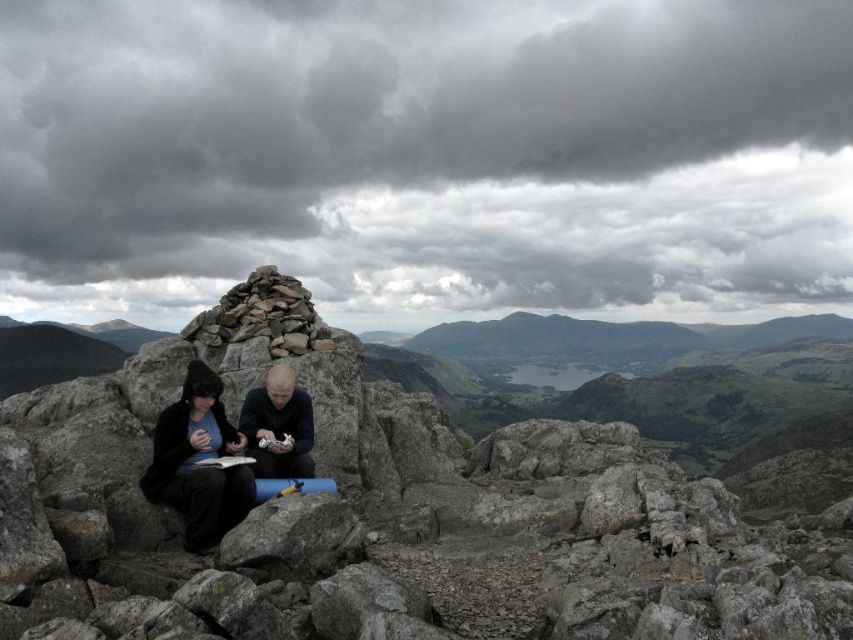
Question: Can you confirm if matte black jacket at center is thinner than black matte jacket at center?

Choices:
 (A) no
 (B) yes

Answer: (A)

Question: Does matte black jacket at center lie in front of black matte jacket at center?

Choices:
 (A) yes
 (B) no

Answer: (A)

Question: Among these objects, which one is farthest from the camera?

Choices:
 (A) gray rock pile at center
 (B) rough stone cairn at center

Answer: (A)

Question: Based on their relative distances, which object is nearer to the gray rock pile at center?

Choices:
 (A) rough stone cairn at center
 (B) matte black jacket at center

Answer: (B)

Question: Which object is farther from the camera taking this photo?

Choices:
 (A) matte black jacket at center
 (B) gray rock pile at center
 (C) rough stone cairn at center

Answer: (B)

Question: Does rough stone cairn at center appear on the right side of matte black jacket at center?

Choices:
 (A) no
 (B) yes

Answer: (B)